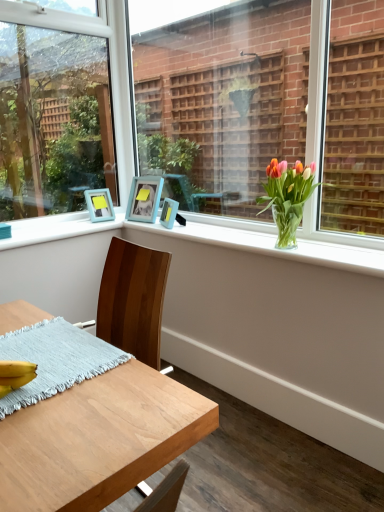
Question: From their relative heights in the image, would you say blue woven placemat at lower left is taller or shorter than translucent glass vase at upper right?

Choices:
 (A) tall
 (B) short

Answer: (B)

Question: From a real-world perspective, relative to translucent glass vase at upper right, is blue woven placemat at lower left vertically above or below?

Choices:
 (A) above
 (B) below

Answer: (B)

Question: Which object is positioned closest to the clear glass window at upper left, which appears as the 2th window when viewed from the right?

Choices:
 (A) matte blue picture frame at upper center, which ranks as the 3th picture frame in left-to-right order
 (B) clear glass vase at center, which is the 2th window in left-to-right order
 (C) teal wooden picture frame at upper left, the first picture frame viewed from the left
 (D) wooden desk at lower left
 (E) blue woven placemat at lower left

Answer: (B)

Question: Which object is positioned farthest from the matte blue picture frame at upper center, which is the 1th picture frame in right-to-left order?

Choices:
 (A) clear glass vase at upper center
 (B) wooden desk at lower left
 (C) blue matte picture frame at upper center, the second picture frame viewed from the left
 (D) blue woven placemat at lower left
 (E) translucent glass vase at upper right

Answer: (B)